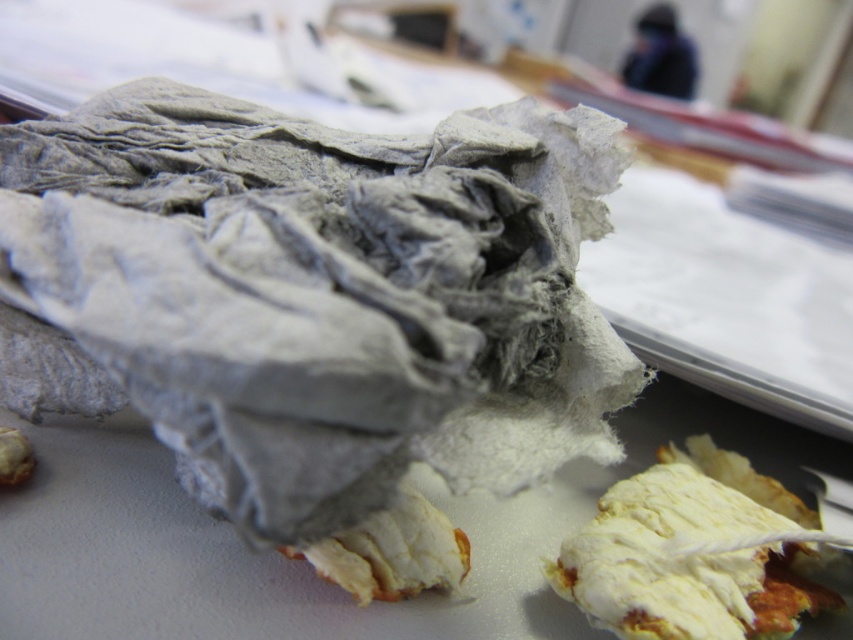
Question: Can you confirm if white crumbly bread at lower right is smaller than white crumbly dough at lower center?

Choices:
 (A) yes
 (B) no

Answer: (B)

Question: Which of the following is the closest to the observer?

Choices:
 (A) 401,544
 (B) 728,513

Answer: (A)

Question: Does white crumbly bread at lower right have a lesser width compared to white crumbly dough at lower center?

Choices:
 (A) no
 (B) yes

Answer: (A)

Question: Which object appears closest to the camera in this image?

Choices:
 (A) white crumbly dough at lower center
 (B) white crumbly bread at lower right

Answer: (A)

Question: Which point is farther to the camera?

Choices:
 (A) (804, 508)
 (B) (357, 573)

Answer: (A)

Question: Can you confirm if white crumbly bread at lower right is smaller than white crumbly dough at lower center?

Choices:
 (A) yes
 (B) no

Answer: (B)